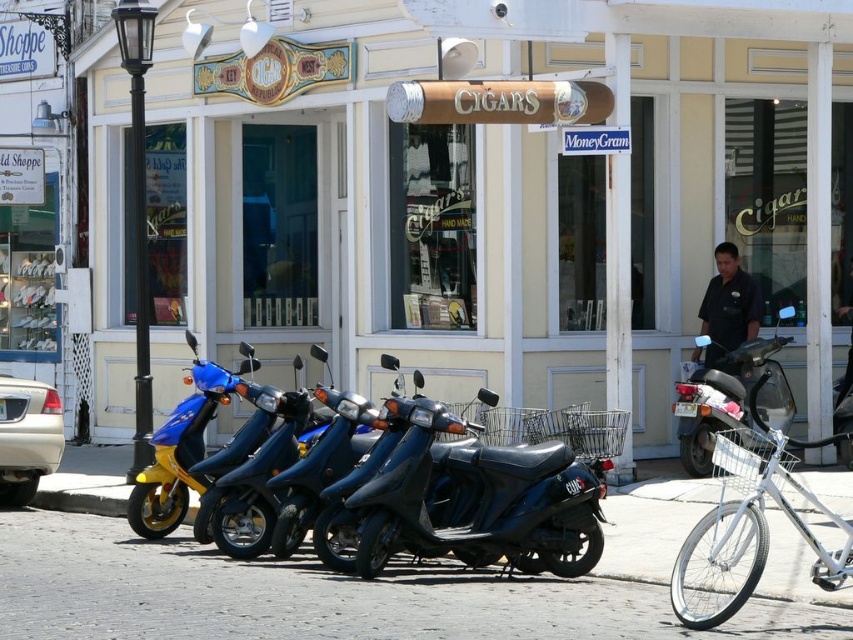
You are a delivery person who needs to move the white metallic bicycle at lower right to make space for a larger vehicle. Since the metallic blue scooter at center is in the way, can you move the bicycle to the right side of the scooter?

The white metallic bicycle at lower right is positioned on the left side of the metallic blue scooter at center, so moving it to the right side of the scooter is possible as there is space available.

You are a delivery person who needs to move your white metallic bicycle at lower right closer to the entrance of the building. However, there is a metallic blue scooter at center blocking the path. Can you move the bicycle around the scooter without going onto the cobblestone pavement?

The white metallic bicycle at lower right is located below the metallic blue scooter at center. Since the bicycle is already positioned below the scooter, you can move it around the scooter by going around the lower side without needing to step onto the cobblestone pavement.

You are standing at the entrance of the building with the CIGARS sign. You want to place a new scooter on the cobblestone pavement at center. What are the coordinates where you should place it?

The coordinates for the cobblestone pavement at center are at point (321, 596), so you should place the scooter there.